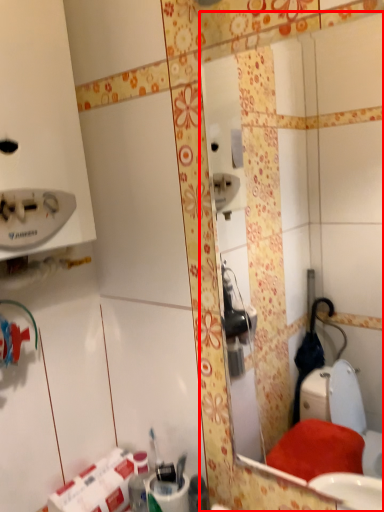
Question: From the image's perspective, considering the relative positions of mirror (annotated by the red box) and toilet paper in the image provided, where is mirror (annotated by the red box) located with respect to the staircase?

Choices:
 (A) below
 (B) above

Answer: (B)